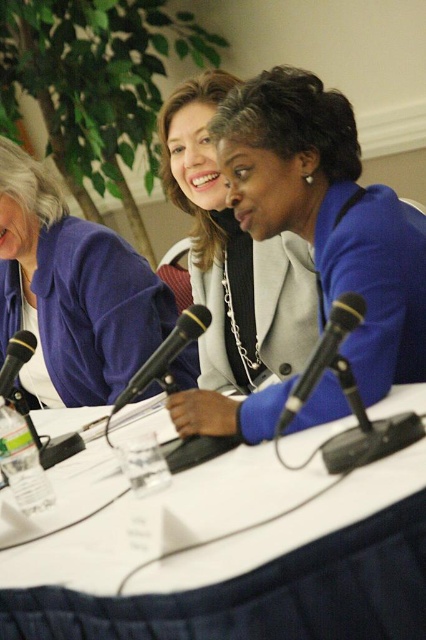
Can you confirm if black metallic microphone at center is shorter than black plastic microphone at center?

Incorrect, black metallic microphone at center's height does not fall short of black plastic microphone at center's.

Is point (345, 316) positioned behind point (141, 369)?

No, it is in front of (141, 369).

The height and width of the screenshot is (640, 426). What do you see at coordinates (324, 353) in the screenshot?
I see `black metallic microphone at center` at bounding box center [324, 353].

Locate an element on the screen. This screenshot has height=640, width=426. black metallic microphone at center is located at coordinates (324, 353).

Does white plastic table at center appear on the right side of black plastic microphone at left?

Yes, white plastic table at center is to the right of black plastic microphone at left.

How distant is white plastic table at center from black plastic microphone at left?

21.97 inches

What do you see at coordinates (235, 557) in the screenshot?
I see `white plastic table at center` at bounding box center [235, 557].

At what (x,y) coordinates should I click in order to perform the action: click on white plastic table at center. Please return your answer as a coordinate pair (x, y). This screenshot has height=640, width=426. Looking at the image, I should click on (235, 557).

This screenshot has height=640, width=426. What do you see at coordinates (71, 292) in the screenshot?
I see `matte blue sweater at center` at bounding box center [71, 292].

Is matte blue sweater at center below black plastic microphone at left?

No, matte blue sweater at center is not below black plastic microphone at left.

You are a GUI agent. You are given a task and a screenshot of the screen. Output one action in this format:
    pyautogui.click(x=<x>, y=<y>)
    Task: Click on the matte blue sweater at center
    The height and width of the screenshot is (640, 426).
    Given the screenshot: What is the action you would take?
    pyautogui.click(x=71, y=292)